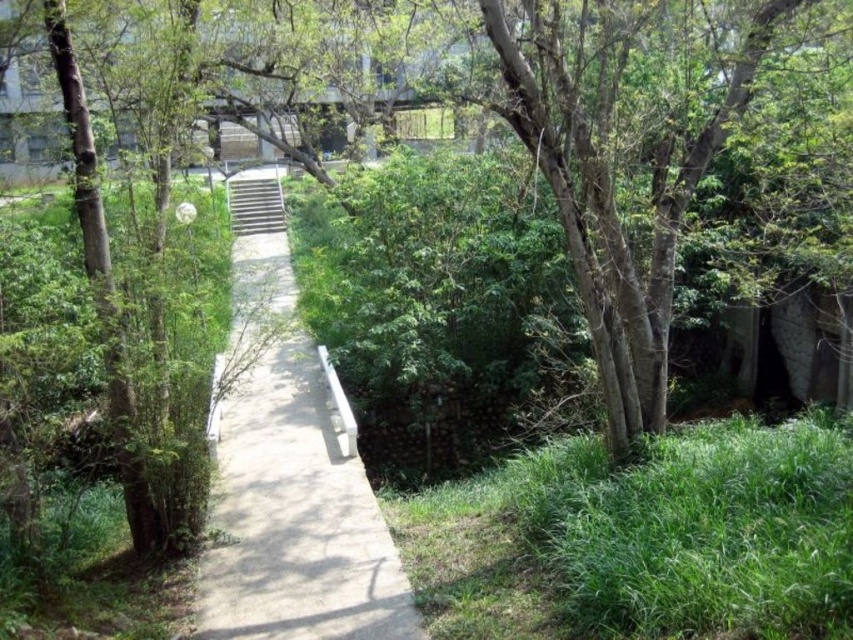
Question: Which of the following is the closest to the observer?

Choices:
 (A) concrete at center
 (B) metallic gray stairs at center

Answer: (A)

Question: Which object is closer to the camera taking this photo?

Choices:
 (A) metallic gray stairs at center
 (B) concrete at center

Answer: (B)

Question: Among these points, which one is nearest to the camera?

Choices:
 (A) (268, 221)
 (B) (308, 621)

Answer: (B)

Question: Is concrete at center positioned behind metallic gray stairs at center?

Choices:
 (A) yes
 (B) no

Answer: (B)

Question: Does concrete at center have a greater width compared to metallic gray stairs at center?

Choices:
 (A) no
 (B) yes

Answer: (A)

Question: Does concrete at center have a larger size compared to metallic gray stairs at center?

Choices:
 (A) yes
 (B) no

Answer: (B)